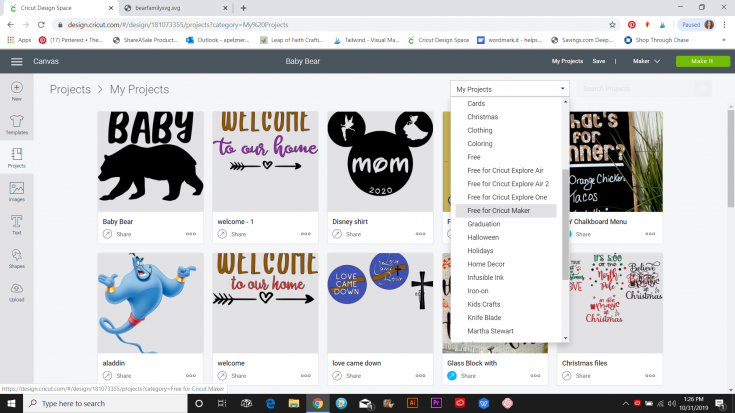
Where is `canvas`? canvas is located at coordinates (50, 63).